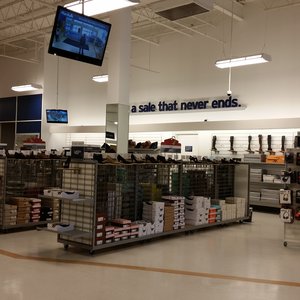
The image size is (300, 300). I want to click on hanging lights, so click(x=26, y=90), click(x=97, y=77), click(x=234, y=61).